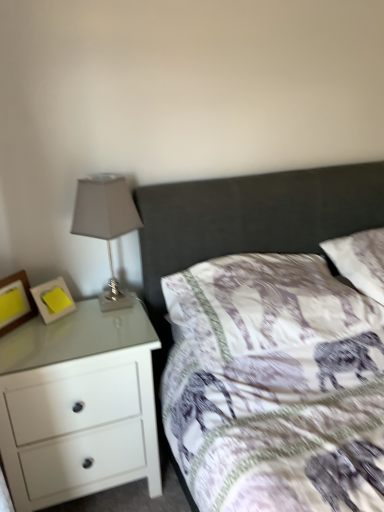
At what (x,y) coordinates should I click in order to perform the action: click on free space in front of wooden picture frame at left, marked as the first picture frame in a left-to-right arrangement. Please return your answer as a coordinate pair (x, y). The width and height of the screenshot is (384, 512). Looking at the image, I should click on (14, 350).